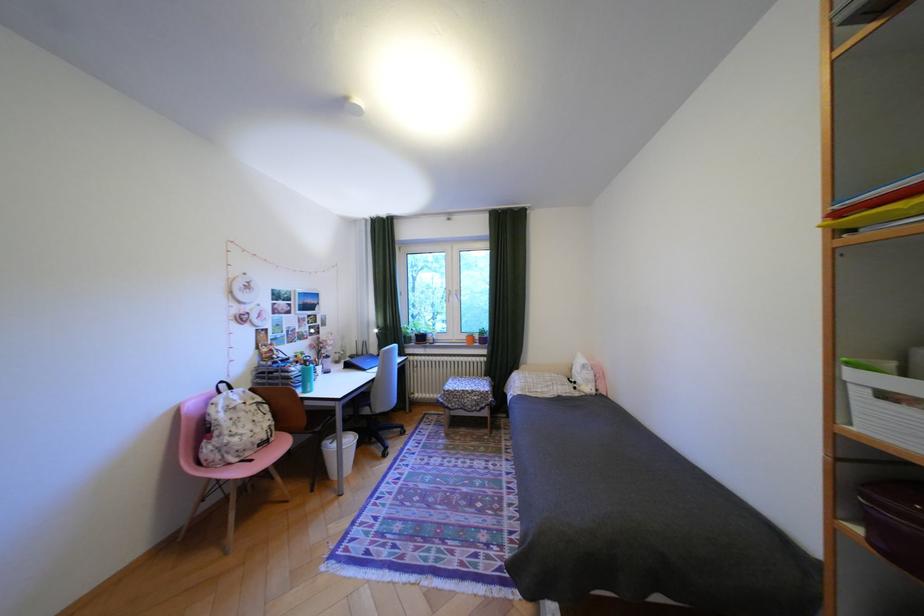
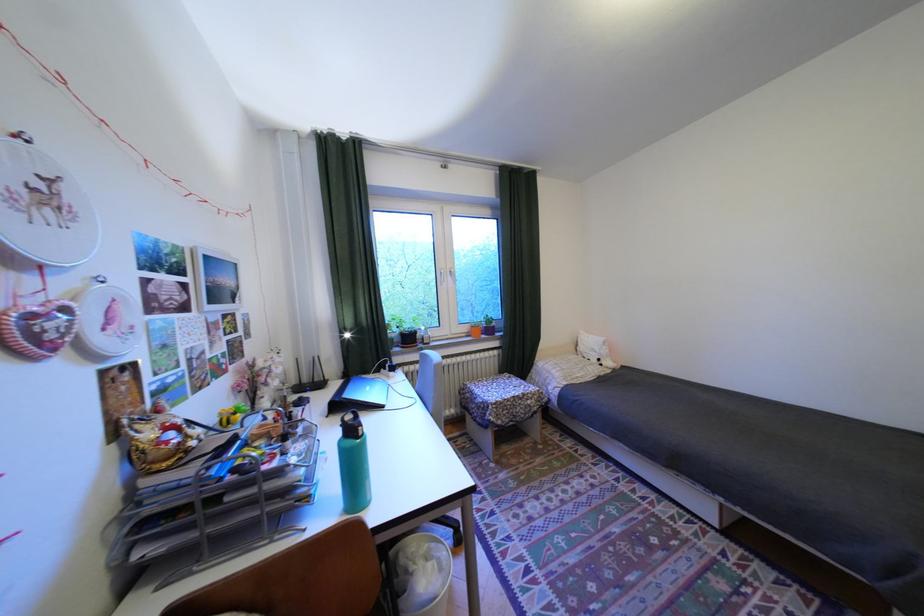
Where in the second image is the point corresponding to (587,383) from the first image?

(611, 360)